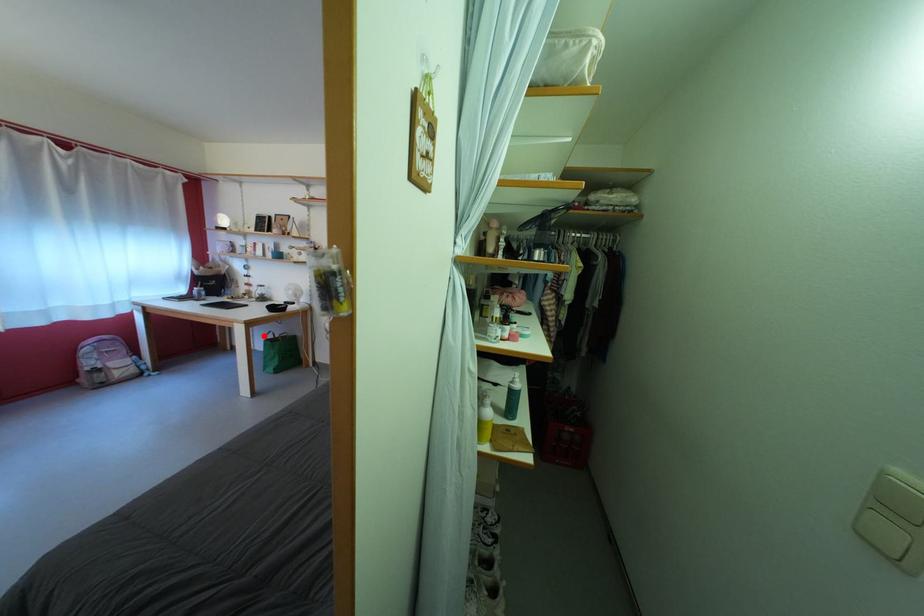
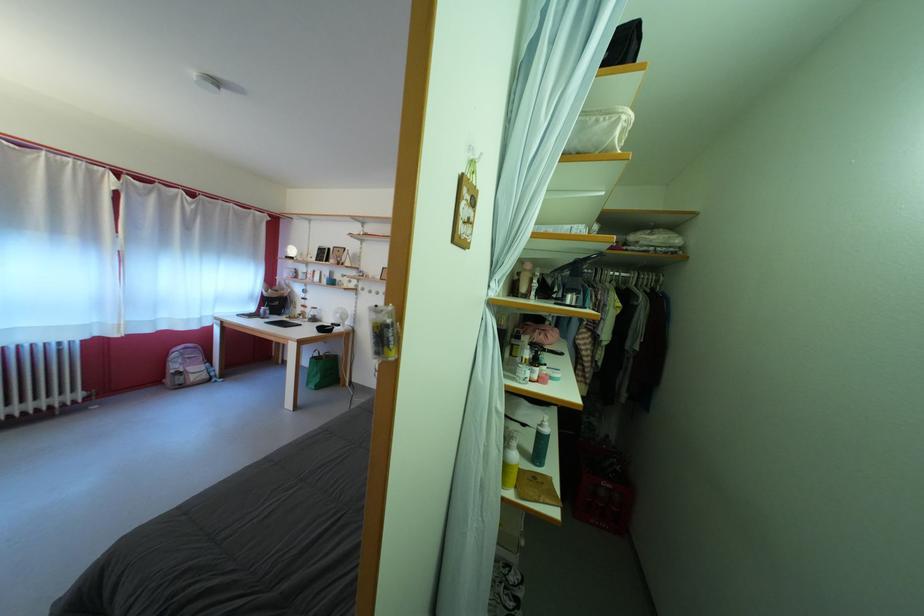
The point at the highlighted location is marked in the first image. Where is the corresponding point in the second image?

(313, 353)